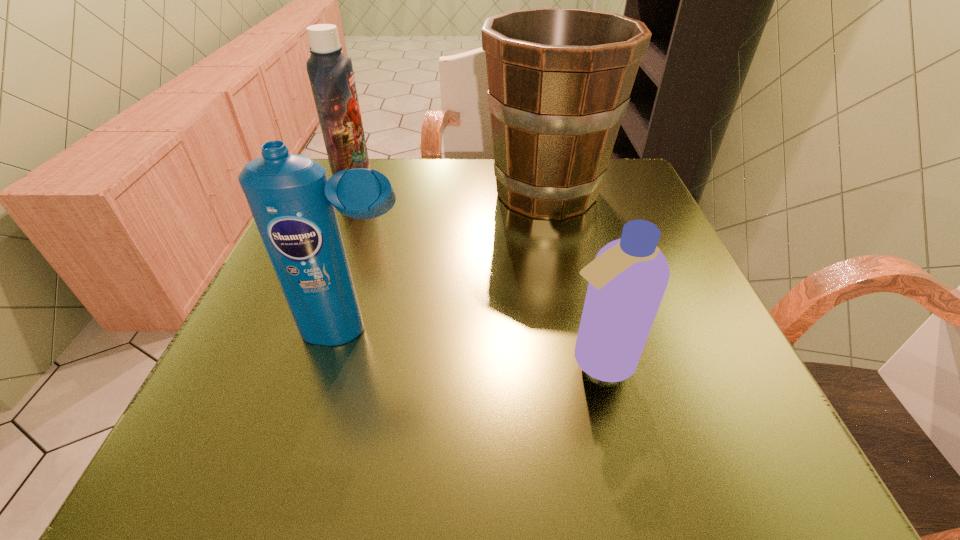
Locate an element on the screen. The height and width of the screenshot is (540, 960). bucket is located at coordinates (559, 79).

Find the location of a particular element. Image resolution: width=960 pixels, height=540 pixels. the farthest shampoo is located at coordinates (330, 72).

Where is `the shortest object`? The width and height of the screenshot is (960, 540). the shortest object is located at coordinates (627, 280).

The height and width of the screenshot is (540, 960). I want to click on the shortest shampoo, so click(x=627, y=280).

Identify the location of vacant point located 0.160m on the front of the bucket. The width and height of the screenshot is (960, 540). (565, 281).

This screenshot has height=540, width=960. I want to click on vacant space positioned on the front label of the farthest shampoo, so click(x=449, y=188).

Identify the location of free location located 0.050m on the back of the rightmost shampoo. (586, 313).

Find the location of `bucket that is positioned at the far edge`. bucket that is positioned at the far edge is located at coordinates (559, 79).

Locate an element on the screen. shampoo present at the far edge is located at coordinates (330, 72).

Identify the location of bucket located at the right edge. The width and height of the screenshot is (960, 540). (559, 79).